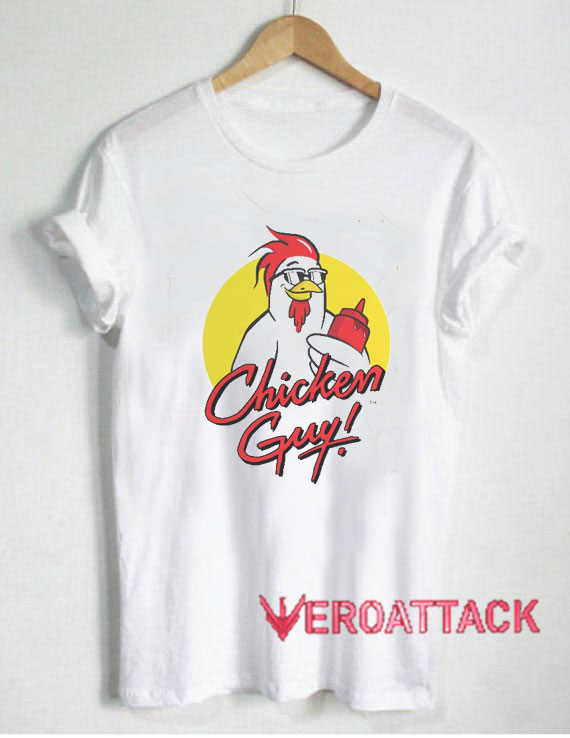
In order to click on frames in this screenshot , I will do `click(294, 277)`, `click(317, 272)`.